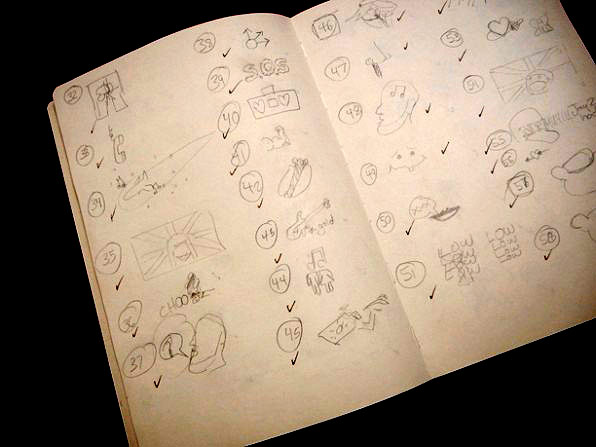
Identify the location of open handmade book with numbers and illustrations. (204, 192).